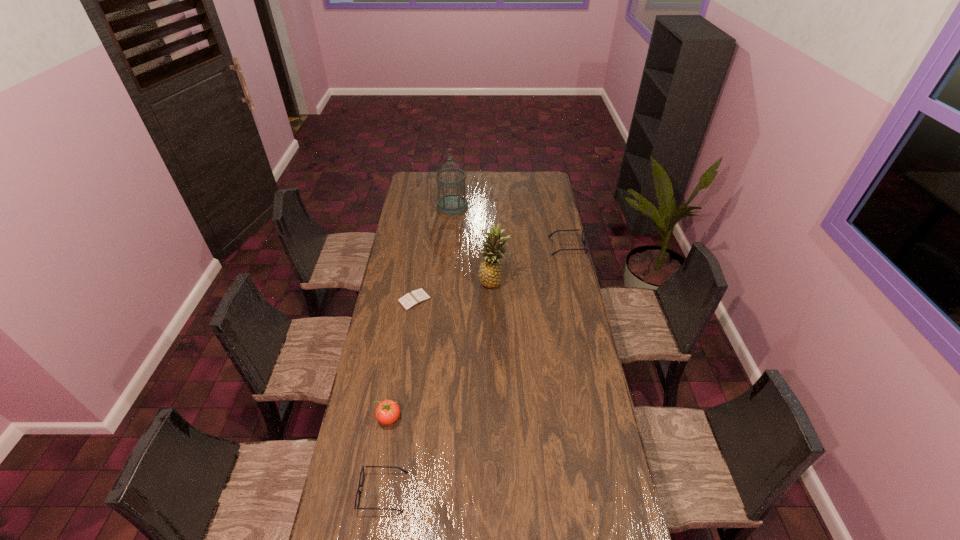
The width and height of the screenshot is (960, 540). In order to click on free space for an extra spectacles to achieve even spacing in this screenshot , I will do `click(497, 339)`.